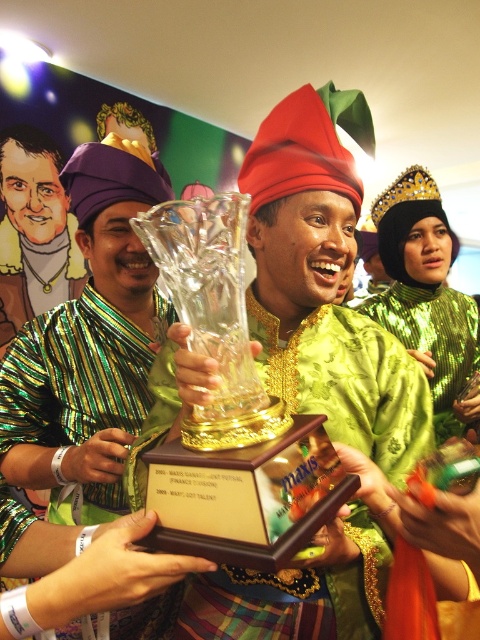
Based on the scene description, where is the translucent glass trophy at center located in terms of its 2D coordinates?

The translucent glass trophy at center is located at the 2D coordinates of point (348, 381).

You are a photographer at the event and want to capture a photo of both the clear glass trophy at center and the green sequined dress at center. Based on their positions, which object should you focus on first to ensure both are in frame?

The clear glass trophy at center is positioned on the left side of green sequined dress at center, so you should focus on the green sequined dress at center first to ensure both are in frame.